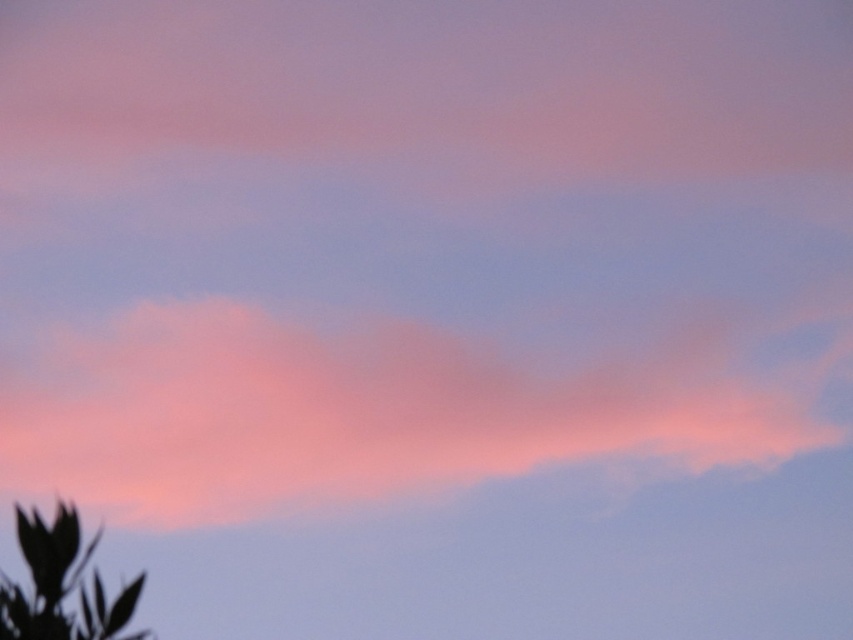
Which is above, pink fluffy cloud at center or silhouette leaf at lower left?

pink fluffy cloud at center is higher up.

How distant is pink fluffy cloud at center from silhouette leaf at lower left?

pink fluffy cloud at center is 3.45 meters away from silhouette leaf at lower left.

Is point (381, 490) positioned behind point (42, 612)?

Yes, it is behind point (42, 612).

What are the coordinates of `pink fluffy cloud at center` in the screenshot? It's located at (354, 412).